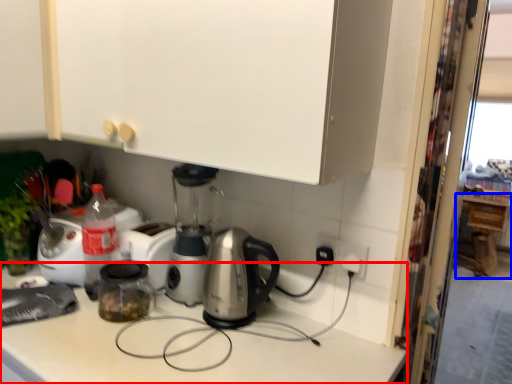
Question: Among these objects, which one is farthest to the camera, counter top (highlighted by a red box) or cabinetry (highlighted by a blue box)?

Choices:
 (A) counter top
 (B) cabinetry

Answer: (B)